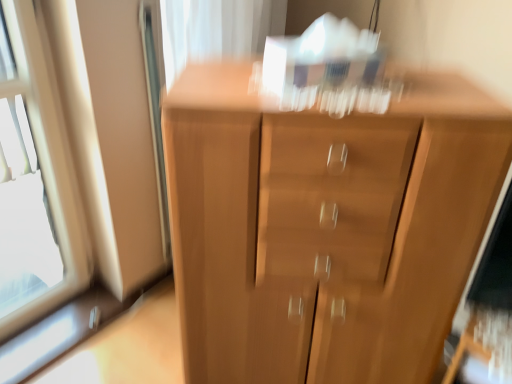
Question: In which direction should I rotate to look at light brown wood chest of drawers at center?

Choices:
 (A) left
 (B) right

Answer: (B)